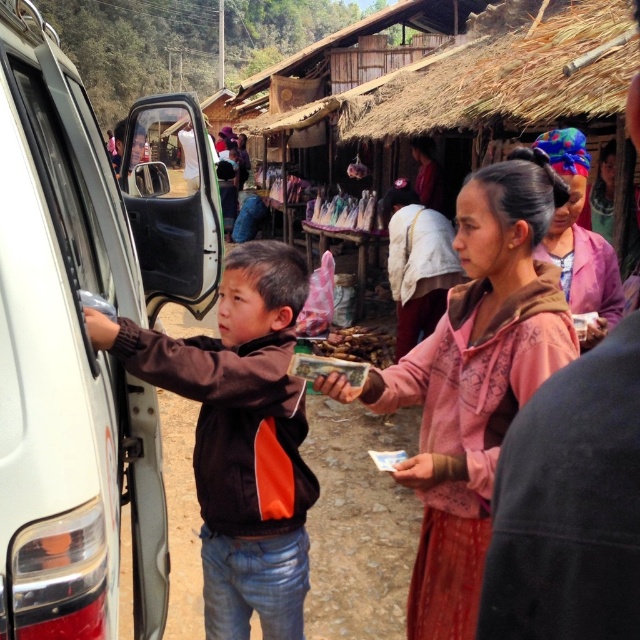
Is the position of pink cotton hoodie at center more distant than that of pink fabric at center?

Answer: No, pink cotton hoodie at center is closer to the viewer.

Does pink cotton hoodie at center have a larger size compared to pink fabric at center?

Actually, pink cotton hoodie at center might be smaller than pink fabric at center.

Locate an element on the screen. Image resolution: width=640 pixels, height=640 pixels. pink cotton hoodie at center is located at coordinates (474, 381).

From the picture: Between white matte van at left and brown fabric jacket at left, which one is positioned higher?

white matte van at left is above.

Does white matte van at left have a greater height compared to brown fabric jacket at left?

Indeed, white matte van at left has a greater height compared to brown fabric jacket at left.

This screenshot has height=640, width=640. What are the coordinates of `white matte van at left` in the screenshot? It's located at (77, 352).

Locate an element on the screen. Image resolution: width=640 pixels, height=640 pixels. white matte van at left is located at coordinates (77, 352).

Can you confirm if pink fabric at center is bigger than brown wooden sticks at center?

Indeed, pink fabric at center has a larger size compared to brown wooden sticks at center.

Is pink fabric at center below brown wooden sticks at center?

No, pink fabric at center is not below brown wooden sticks at center.

Between point (602, 326) and point (356, 352), which one is positioned in front?

Point (602, 326) is in front.

Locate an element on the screen. pink fabric at center is located at coordinates (577, 237).